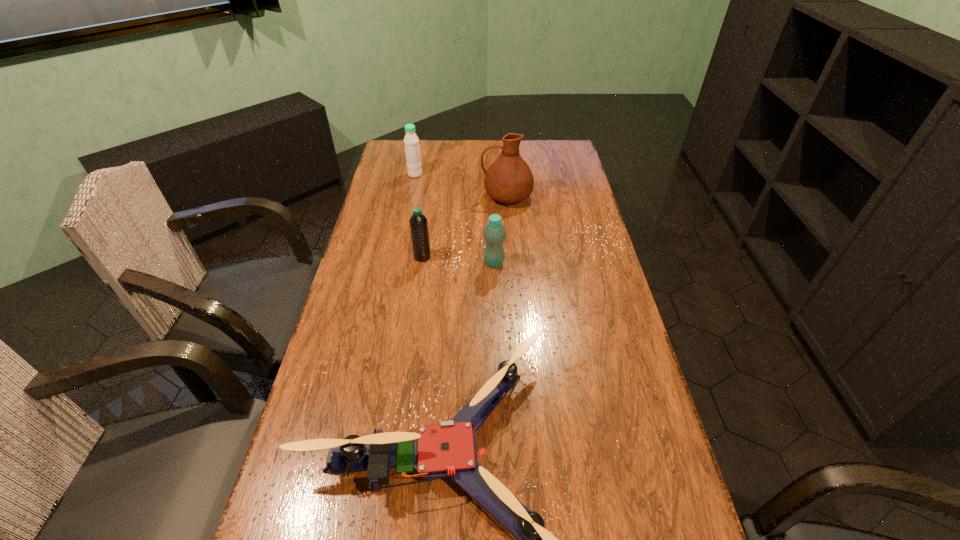
Identify the location of object that is the third closest to the farthest object. The width and height of the screenshot is (960, 540). (494, 233).

Identify the location of the second closest object to the rightmost water bottle. (509, 180).

Locate an element on the screen. water bottle that is the nearest to the rightmost water bottle is located at coordinates (418, 223).

Find the location of a particular element. This screenshot has height=540, width=960. water bottle that can be found as the third closest to the drone is located at coordinates pyautogui.click(x=411, y=142).